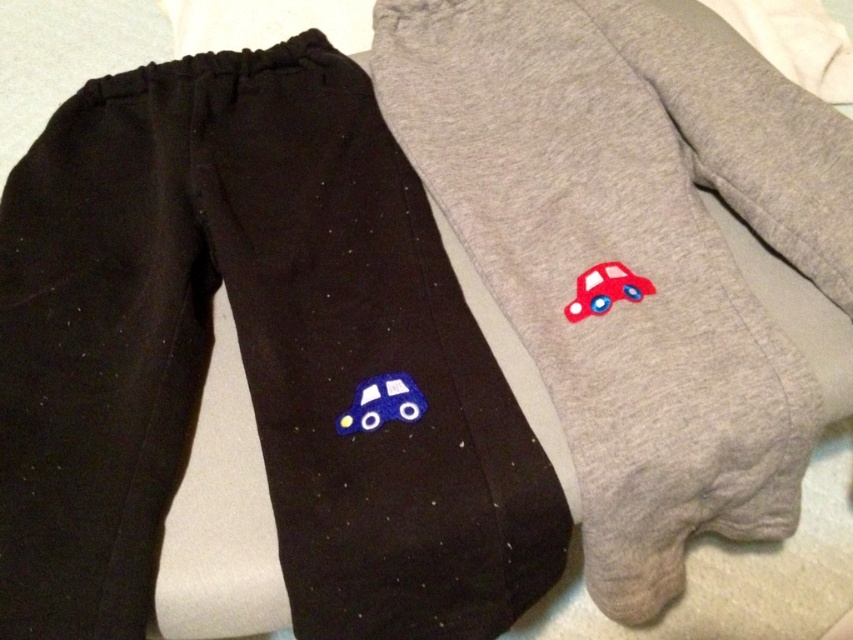
Question: Can you confirm if matte black pants at left is bigger than felt blue car at lower left?

Choices:
 (A) yes
 (B) no

Answer: (A)

Question: Does matte black pants at left appear over gray cotton pants at center?

Choices:
 (A) yes
 (B) no

Answer: (B)

Question: Which point is closer to the camera?

Choices:
 (A) matte fabric car at right
 (B) gray cotton pants at center
 (C) matte black pants at left
 (D) felt blue car at lower left

Answer: (C)

Question: Can you confirm if felt blue car at lower left is positioned to the left of matte fabric car at right?

Choices:
 (A) yes
 (B) no

Answer: (A)

Question: Which point is closer to the camera?

Choices:
 (A) (22, 244)
 (B) (606, 310)
 (C) (605, 131)
 (D) (387, 406)

Answer: (D)

Question: Which point is closer to the camera taking this photo?

Choices:
 (A) (320, 140)
 (B) (801, 470)
 (C) (619, 282)

Answer: (B)